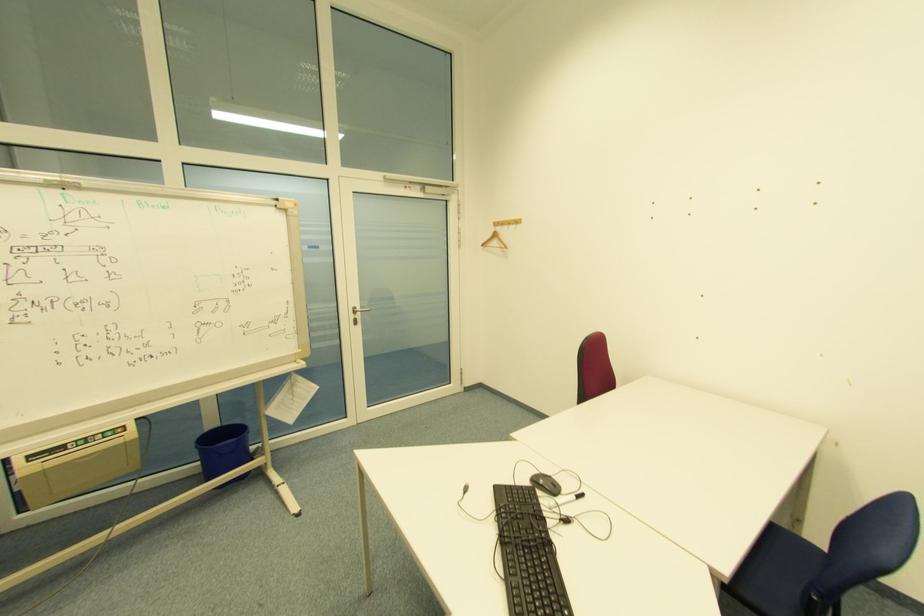
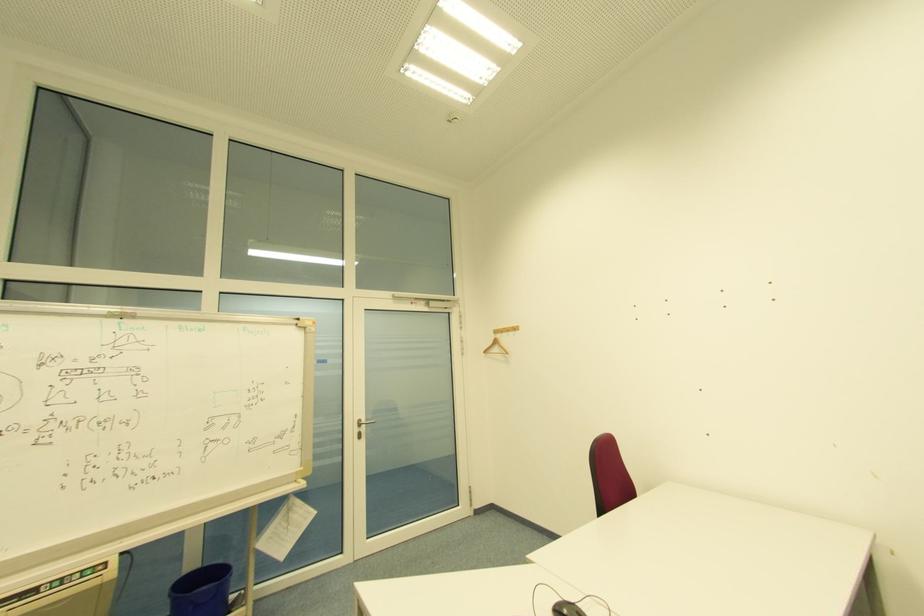
Question: What movement of the cameraman would produce the second image?

Choices:
 (A) Left
 (B) Right
 (C) Forward
 (D) Backward

Answer: (D)